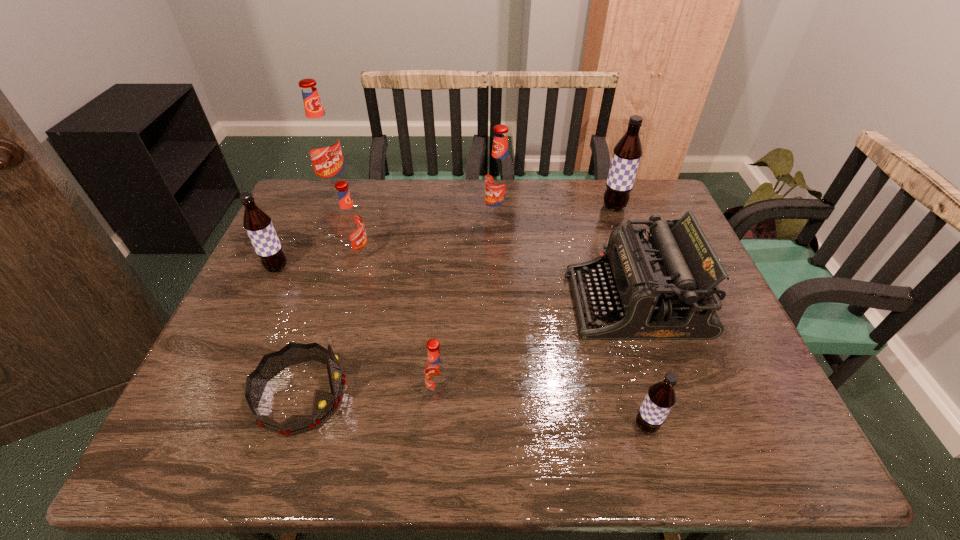
What are the coordinates of `vacant space located 0.320m on the right of the leftmost brown root beer` in the screenshot? It's located at (405, 267).

This screenshot has height=540, width=960. Find the location of `vacant space situated on the front of the third biggest red root beer`. vacant space situated on the front of the third biggest red root beer is located at coordinates (322, 386).

At what (x,y) coordinates should I click in order to perform the action: click on vacant space positioned 0.200m on the keyboard of the typewriter. Please return your answer as a coordinate pair (x, y). This screenshot has width=960, height=540. Looking at the image, I should click on pyautogui.click(x=492, y=302).

At what (x,y) coordinates should I click in order to perform the action: click on vacant space located 0.250m on the keyboard of the typewriter. Please return your answer as a coordinate pair (x, y). The image size is (960, 540). Looking at the image, I should click on pos(471,302).

Where is `free region located 0.400m on the keyboard of the typewriter`? free region located 0.400m on the keyboard of the typewriter is located at coordinates (413, 302).

This screenshot has height=540, width=960. Identify the location of vacant space located on the right of the nearest brown root beer. (762, 426).

Identify the location of free space located 0.080m on the left of the fourth root beer from right to left. The image size is (960, 540). (390, 394).

Identify the location of free space located at the front of the red tiara with jewels. The height and width of the screenshot is (540, 960). (431, 395).

Where is `root beer positioned at the near edge`? The width and height of the screenshot is (960, 540). root beer positioned at the near edge is located at coordinates (661, 396).

Identify the location of tiara that is positioned at the near edge. This screenshot has height=540, width=960. (324, 404).